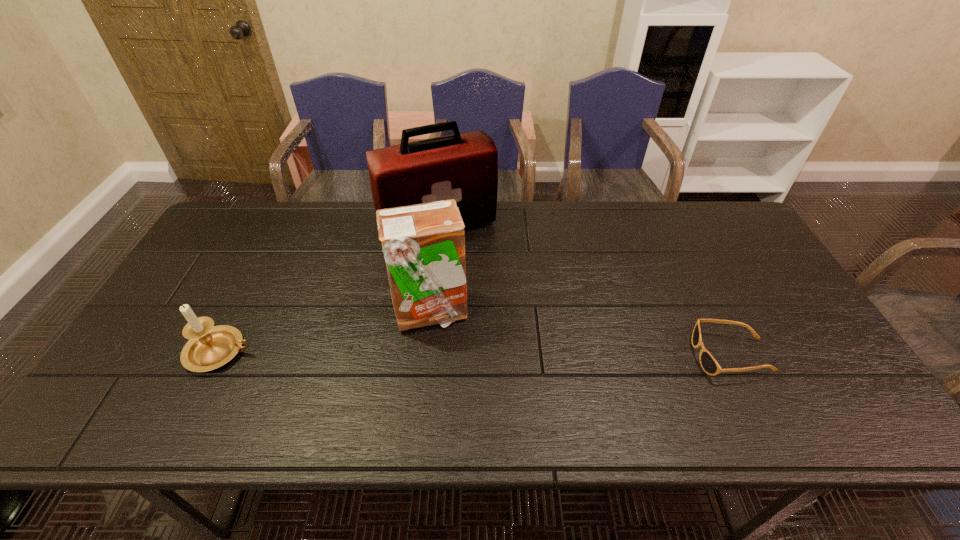
The width and height of the screenshot is (960, 540). I want to click on vacant space on the desktop that is between the candle holder and the sunglasses and is positioned on the straw side of the carton, so click(506, 354).

This screenshot has height=540, width=960. Identify the location of vacant spot on the desktop that is between the leftmost object and the shortest object and is positioned on the side of the first aid kit with the cross symbol. (505, 354).